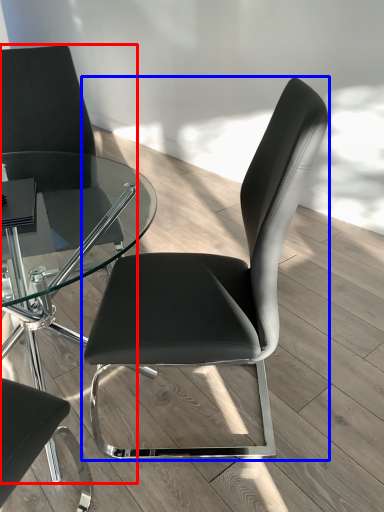
Question: Which object appears farthest to the camera in this image, chair (highlighted by a red box) or chair (highlighted by a blue box)?

Choices:
 (A) chair
 (B) chair

Answer: (A)